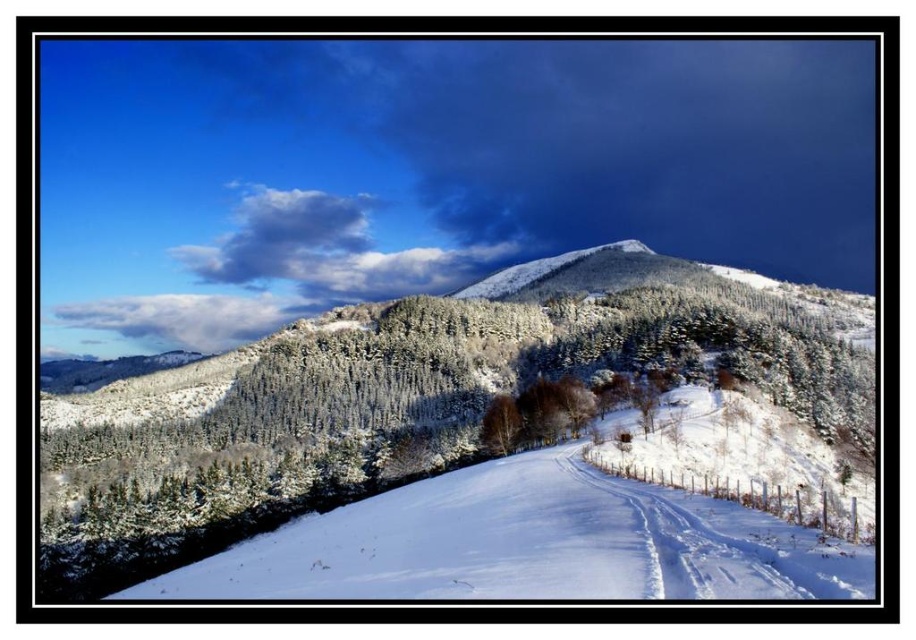
Does white snow ski slope at center have a greater height compared to brown wood tree at center?

Yes, white snow ski slope at center is taller than brown wood tree at center.

Does point (547, 529) come in front of point (508, 403)?

Yes, it is.

Where is `white snow ski slope at center`? This screenshot has height=640, width=916. white snow ski slope at center is located at coordinates (566, 524).

Where is `white snow ski slope at center`? The width and height of the screenshot is (916, 640). white snow ski slope at center is located at coordinates (566, 524).